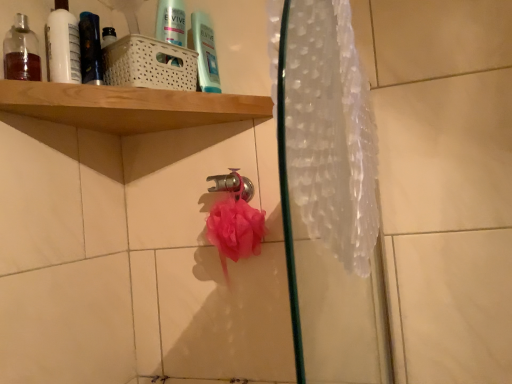
The height and width of the screenshot is (384, 512). Identify the location of translucent glass bottle at upper left, positioned as the 2th mouthwash in back-to-front order. (21, 52).

The height and width of the screenshot is (384, 512). Describe the element at coordinates (63, 47) in the screenshot. I see `white glossy bottle at upper left, which is the 1th mouthwash from back to front` at that location.

The height and width of the screenshot is (384, 512). What do you see at coordinates (234, 228) in the screenshot? I see `pink mesh sponge at center` at bounding box center [234, 228].

Describe the element at coordinates (233, 184) in the screenshot. I see `metallic silver faucet at center` at that location.

Image resolution: width=512 pixels, height=384 pixels. Identify the location of translucent glass bottle at upper left, the first mouthwash viewed from the front. (21, 52).

Is shiny black bottle at upper left thinner than wooden shelf at upper left?

Correct, the width of shiny black bottle at upper left is less than that of wooden shelf at upper left.

Is shiny black bottle at upper left oriented away from wooden shelf at upper left?

No, shiny black bottle at upper left is not facing the opposite direction of wooden shelf at upper left.

Between shiny black bottle at upper left and wooden shelf at upper left, which one has less height?

Standing shorter between the two is wooden shelf at upper left.

Who is smaller, shiny black bottle at upper left or wooden shelf at upper left?

Smaller between the two is shiny black bottle at upper left.

From a real-world perspective, is metallic silver faucet at center under white glossy bottle at upper left, placed as the second mouthwash when sorted from front to back?

Yes, from a real-world perspective, metallic silver faucet at center is under white glossy bottle at upper left, placed as the second mouthwash when sorted from front to back.

Considering the positions of objects metallic silver faucet at center and white glossy bottle at upper left, placed as the second mouthwash when sorted from front to back, in the image provided, who is more to the left, metallic silver faucet at center or white glossy bottle at upper left, placed as the second mouthwash when sorted from front to back,?

Positioned to the left is white glossy bottle at upper left, placed as the second mouthwash when sorted from front to back.

Is point (244, 188) positioned after point (75, 72)?

That is True.

Is metallic silver faucet at center far from white glossy bottle at upper left, which is the 1th mouthwash from back to front?

No.

Can you tell me how much translucent glass bottle at upper left, positioned as the 2th mouthwash in back-to-front order, and metallic silver faucet at center differ in facing direction?

There is a 41.4-degree angle between the facing directions of translucent glass bottle at upper left, positioned as the 2th mouthwash in back-to-front order, and metallic silver faucet at center.

Would you consider translucent glass bottle at upper left, positioned as the 2th mouthwash in back-to-front order, to be distant from metallic silver faucet at center?

No, translucent glass bottle at upper left, positioned as the 2th mouthwash in back-to-front order, is not far away from metallic silver faucet at center.

Is translucent glass bottle at upper left, positioned as the 2th mouthwash in back-to-front order, oriented away from metallic silver faucet at center?

translucent glass bottle at upper left, positioned as the 2th mouthwash in back-to-front order, is not turned away from metallic silver faucet at center.

Consider the image. Can we say translucent glass bottle at upper left, positioned as the 2th mouthwash in back-to-front order, lies outside metallic silver faucet at center?

translucent glass bottle at upper left, positioned as the 2th mouthwash in back-to-front order, lies outside metallic silver faucet at center's area.

Between pink mesh sponge at center and wooden shelf at upper left, which one appears on the left side from the viewer's perspective?

wooden shelf at upper left is more to the left.

Is pink mesh sponge at center positioned in front of wooden shelf at upper left?

No, pink mesh sponge at center is further to the viewer.

Based on the photo, from a real-world perspective, between pink mesh sponge at center and wooden shelf at upper left, who is vertically lower?

In real-world perspective, pink mesh sponge at center is lower.

Is there a large distance between shiny black bottle at upper left and metallic silver faucet at center?

No.

Is shiny black bottle at upper left turned away from metallic silver faucet at center?

No, shiny black bottle at upper left's orientation is not away from metallic silver faucet at center.

Considering the positions of objects shiny black bottle at upper left and metallic silver faucet at center in the image provided, who is more to the right, shiny black bottle at upper left or metallic silver faucet at center?

metallic silver faucet at center is more to the right.

Is point (83, 14) farther from camera compared to point (234, 169)?

No, (83, 14) is closer to viewer.

Considering the points (227, 187) and (351, 54), which point is in front, point (227, 187) or point (351, 54)?

Point (351, 54)

Is metallic silver faucet at center at the right side of translucent plastic shower curtain at right?

Incorrect, metallic silver faucet at center is not on the right side of translucent plastic shower curtain at right.

Image resolution: width=512 pixels, height=384 pixels. Find the location of `shower curtain above the metallic silver faucet at center (from a real-world perspective)`. shower curtain above the metallic silver faucet at center (from a real-world perspective) is located at coordinates (330, 132).

Considering the relative sizes of metallic silver faucet at center and translucent plastic shower curtain at right in the image provided, is metallic silver faucet at center thinner than translucent plastic shower curtain at right?

Yes, metallic silver faucet at center is thinner than translucent plastic shower curtain at right.

Locate an element on the screen. This screenshot has height=384, width=512. flower that is below the wooden shelf at upper left (from the image's perspective) is located at coordinates (234, 228).

Which is more to the right, wooden shelf at upper left or pink mesh sponge at center?

pink mesh sponge at center is more to the right.

Looking at their sizes, would you say wooden shelf at upper left is wider or thinner than pink mesh sponge at center?

Clearly, wooden shelf at upper left has more width compared to pink mesh sponge at center.

Considering the points (238, 80) and (249, 212), which point is in front, point (238, 80) or point (249, 212)?

The point (249, 212) is closer to the camera.

The width and height of the screenshot is (512, 384). Find the location of `shelf below the shiny black bottle at upper left (from a real-world perspective)`. shelf below the shiny black bottle at upper left (from a real-world perspective) is located at coordinates (160, 90).

The height and width of the screenshot is (384, 512). Find the location of `tap behind the white glossy bottle at upper left, which is the 1th mouthwash from back to front`. tap behind the white glossy bottle at upper left, which is the 1th mouthwash from back to front is located at coordinates (233, 184).

Which object lies nearer to the anchor point translucent plastic shower curtain at right, translucent glass bottle at upper left, positioned as the 2th mouthwash in back-to-front order, or pink mesh sponge at center?

Based on the image, pink mesh sponge at center appears to be nearer to translucent plastic shower curtain at right.

Estimate the real-world distances between objects in this image. Which object is further from translucent plastic shower curtain at right, wooden shelf at upper left or pink mesh sponge at center?

The object further to translucent plastic shower curtain at right is wooden shelf at upper left.

From the picture: Which object lies nearer to the anchor point shiny black bottle at upper left, translucent plastic shower curtain at right or wooden shelf at upper left?

The object closer to shiny black bottle at upper left is wooden shelf at upper left.

Consider the image. Looking at the image, which one is located closer to shiny black bottle at upper left, metallic silver faucet at center or translucent plastic shower curtain at right?

metallic silver faucet at center lies closer to shiny black bottle at upper left than the other object.

Which object lies nearer to the anchor point metallic silver faucet at center, shiny black bottle at upper left or translucent glass bottle at upper left, positioned as the 2th mouthwash in back-to-front order?

shiny black bottle at upper left.

Consider the image. Based on their spatial positions, is metallic silver faucet at center or shiny black bottle at upper left further from pink mesh sponge at center?

shiny black bottle at upper left is positioned further to the anchor pink mesh sponge at center.

Which object lies nearer to the anchor point pink mesh sponge at center, shiny black bottle at upper left or metallic silver faucet at center?

Among the two, metallic silver faucet at center is located nearer to pink mesh sponge at center.

Based on their spatial positions, is metallic silver faucet at center or translucent glass bottle at upper left, the first mouthwash viewed from the front, further from pink mesh sponge at center?

Among the two, translucent glass bottle at upper left, the first mouthwash viewed from the front, is located further to pink mesh sponge at center.

Image resolution: width=512 pixels, height=384 pixels. What are the coordinates of `shelf located between translucent plastic shower curtain at right and white glossy bottle at upper left, placed as the second mouthwash when sorted from front to back, in the depth direction` in the screenshot? It's located at (160, 90).

Find the location of a particular element. The image size is (512, 384). shelf between translucent plastic shower curtain at right and shiny black bottle at upper left from front to back is located at coordinates (160, 90).

The width and height of the screenshot is (512, 384). Identify the location of tap between translucent glass bottle at upper left, the first mouthwash viewed from the front, and pink mesh sponge at center, in the horizontal direction. (233, 184).

The width and height of the screenshot is (512, 384). In order to click on toiletry located between translucent plastic shower curtain at right and pink mesh sponge at center in the depth direction in this screenshot , I will do `click(90, 49)`.